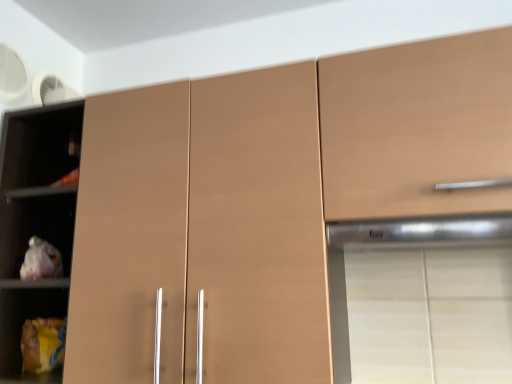
Question: Is satin silver exhaust hood at upper right facing towards matte brown cupboard at left?

Choices:
 (A) no
 (B) yes

Answer: (A)

Question: Does satin silver exhaust hood at upper right have a greater height compared to matte brown cupboard at left?

Choices:
 (A) yes
 (B) no

Answer: (B)

Question: Is satin silver exhaust hood at upper right completely or partially outside of matte brown cupboard at left?

Choices:
 (A) yes
 (B) no

Answer: (A)

Question: From the image's perspective, does satin silver exhaust hood at upper right appear higher than matte brown cupboard at left?

Choices:
 (A) yes
 (B) no

Answer: (A)

Question: Is satin silver exhaust hood at upper right looking in the opposite direction of matte brown cupboard at left?

Choices:
 (A) yes
 (B) no

Answer: (B)

Question: From their relative heights in the image, would you say matte brown cupboard at left is taller or shorter than matte brown cabinet at upper right?

Choices:
 (A) short
 (B) tall

Answer: (B)

Question: From the image's perspective, is matte brown cupboard at left above or below matte brown cabinet at upper right?

Choices:
 (A) above
 (B) below

Answer: (B)

Question: Does point (14, 296) appear closer or farther from the camera than point (334, 114)?

Choices:
 (A) closer
 (B) farther

Answer: (B)

Question: Is matte brown cupboard at left in front of or behind matte brown cabinet at upper right in the image?

Choices:
 (A) behind
 (B) front

Answer: (A)

Question: Considering the positions of point (401, 244) and point (381, 144), is point (401, 244) closer or farther from the camera than point (381, 144)?

Choices:
 (A) farther
 (B) closer

Answer: (A)

Question: From the image's perspective, is satin silver exhaust hood at upper right positioned above or below matte brown cabinet at upper right?

Choices:
 (A) above
 (B) below

Answer: (B)

Question: Based on their positions, is satin silver exhaust hood at upper right located to the left or right of matte brown cabinet at upper right?

Choices:
 (A) left
 (B) right

Answer: (A)

Question: Do you think satin silver exhaust hood at upper right is within matte brown cabinet at upper right, or outside of it?

Choices:
 (A) outside
 (B) inside

Answer: (A)

Question: Is matte brown cupboard at left in front of or behind satin silver exhaust hood at upper right in the image?

Choices:
 (A) behind
 (B) front

Answer: (A)

Question: From a real-world perspective, is matte brown cupboard at left physically located above or below satin silver exhaust hood at upper right?

Choices:
 (A) below
 (B) above

Answer: (B)